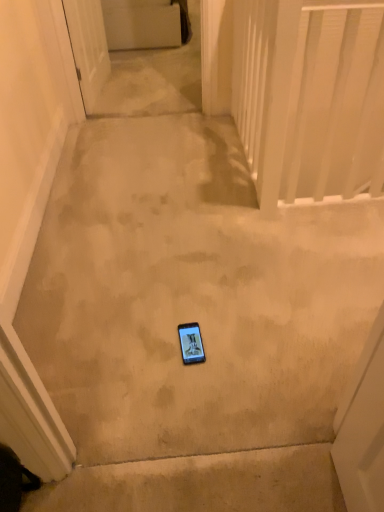
Identify the location of vacant area to the left of matte black phone at center. (144, 348).